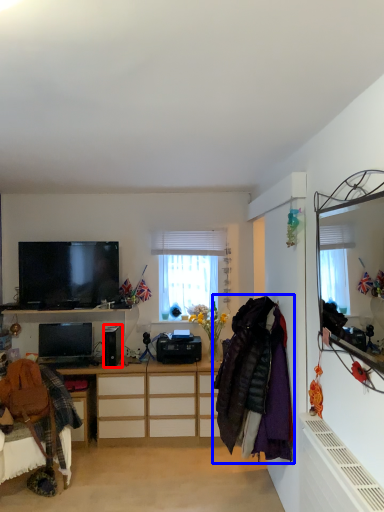
Question: Which object appears closest to the camera in this image, speaker (highlighted by a red box) or clothing (highlighted by a blue box)?

Choices:
 (A) speaker
 (B) clothing

Answer: (B)